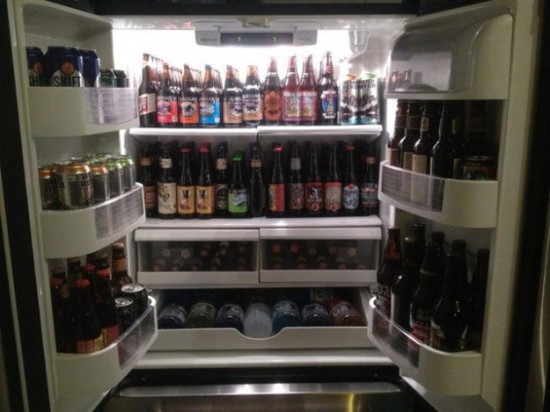
This screenshot has height=412, width=550. Identify the location of freezer. (184, 400).